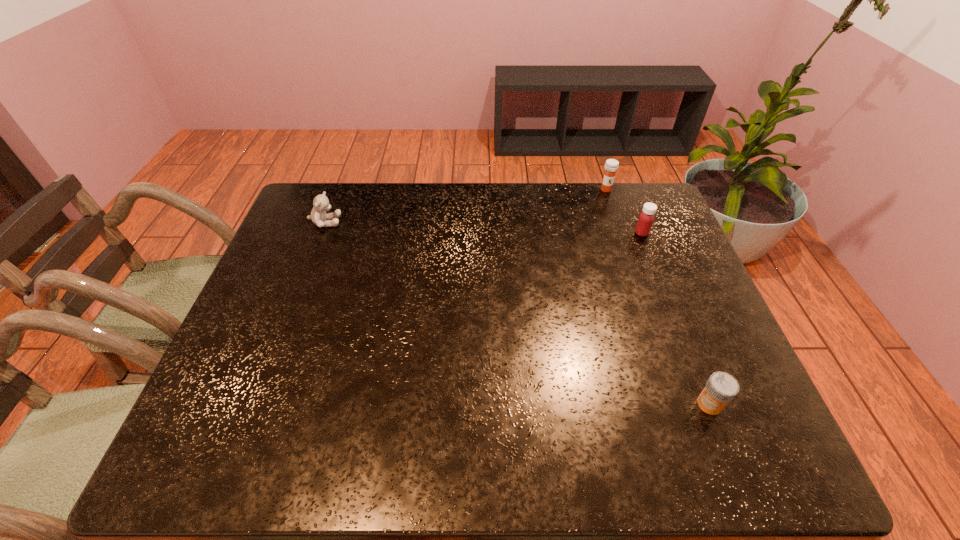
This screenshot has width=960, height=540. What are the coordinates of `free space that is in between the teddy bear and the nearest medicine` in the screenshot? It's located at (517, 313).

The height and width of the screenshot is (540, 960). I want to click on free space between the shortest object and the leftmost object, so click(517, 313).

Where is `vacant area that lies between the second nearest medicine and the leftmost medicine`? Image resolution: width=960 pixels, height=540 pixels. vacant area that lies between the second nearest medicine and the leftmost medicine is located at coordinates (624, 211).

Select which object is the third closest to the shortest object. Please provide its 2D coordinates. Your answer should be formatted as a tuple, i.e. [(x, y)], where the tuple contains the x and y coordinates of a point satisfying the conditions above.

[(321, 204)]

Find the location of a particular element. object that is the third closest to the second nearest medicine is located at coordinates (321, 204).

The image size is (960, 540). Identify the location of medicine that is the closest one to the nearest object. (646, 218).

Locate an element on the screen. medicine that is the closest to the shortest object is located at coordinates (646, 218).

You are a GUI agent. You are given a task and a screenshot of the screen. Output one action in this format:
    pyautogui.click(x=<x>, y=<y>)
    Task: Click on the vacant area that satisfies the following two spatial constraints: 1. on the face of the leftmost object; 2. on the left side of the second nearest medicine
    The width and height of the screenshot is (960, 540).
    Given the screenshot: What is the action you would take?
    pyautogui.click(x=322, y=233)

Locate an element on the screen. vacant region that satisfies the following two spatial constraints: 1. on the label side of the leftmost medicine; 2. on the left side of the second farthest medicine is located at coordinates (621, 233).

Locate an element on the screen. free space in the image that satisfies the following two spatial constraints: 1. on the label side of the second farthest medicine; 2. on the right side of the farthest object is located at coordinates (621, 233).